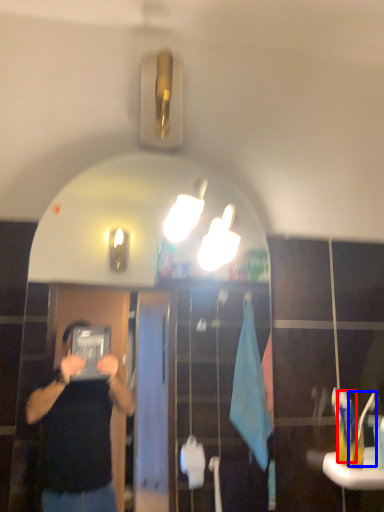
Question: Which point is closer to the camera, toothbrush (highlighted by a red box) or toothbrush (highlighted by a blue box)?

Choices:
 (A) toothbrush
 (B) toothbrush

Answer: (B)